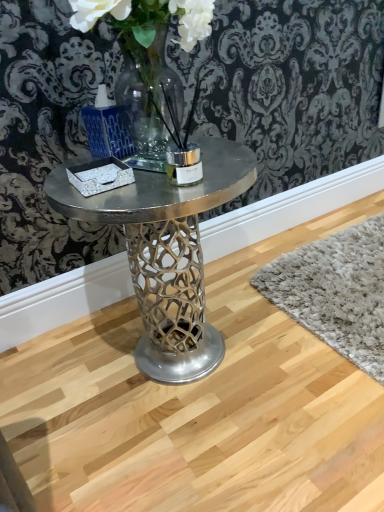
Find the location of a particular element. Image resolution: width=384 pixels, height=512 pixels. vacant point to the right of metallic silver table at center is located at coordinates (302, 370).